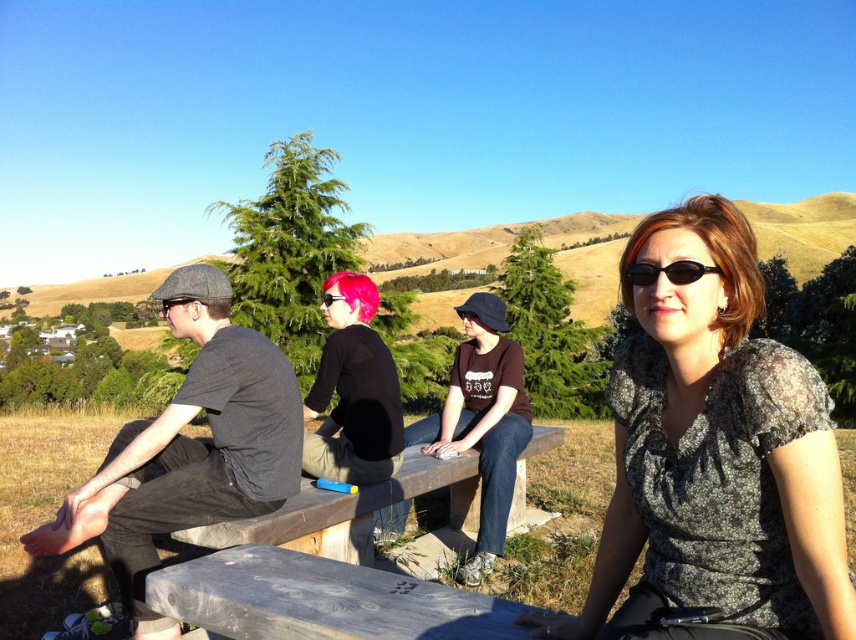
You are a photographer trying to capture a group photo of the matte black shirt at center and the pink matte hair at center. Since you want both subjects to appear the same height in the photo, which subject should you position closer to the camera?

The matte black shirt at center is much taller than the pink matte hair at center, so to make them appear the same height in the photo, the photographer should position the pink matte hair at center closer to the camera.

You are standing at the center of the park and want to place a 1.5 meter long bench between the two people wearing black plastic sunglasses at upper right. Is there enough space between them to place the bench?

The two people wearing black plastic sunglasses at upper right are 1.38 meters apart. Since the bench is 1.5 meters long, there isn not enough space to place it between them.

You are a photographer trying to capture a candid shot of the matte black dress at center and the gray weathered wood bench at center. Since you want to focus on the dress, which object should you position closer to the camera?

The matte black dress at center is above the gray weathered wood bench at center, so you should position the matte black dress at center closer to the camera to focus on it.